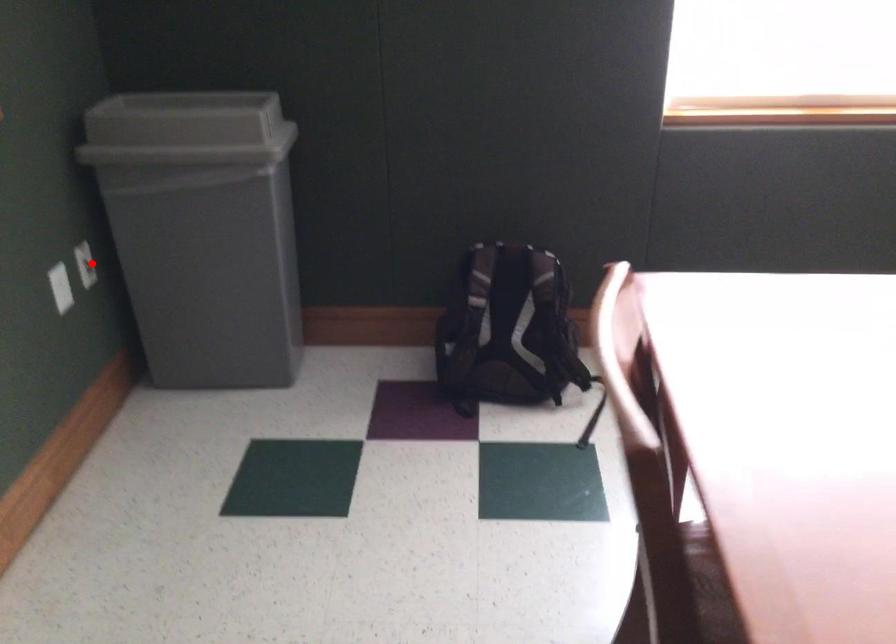
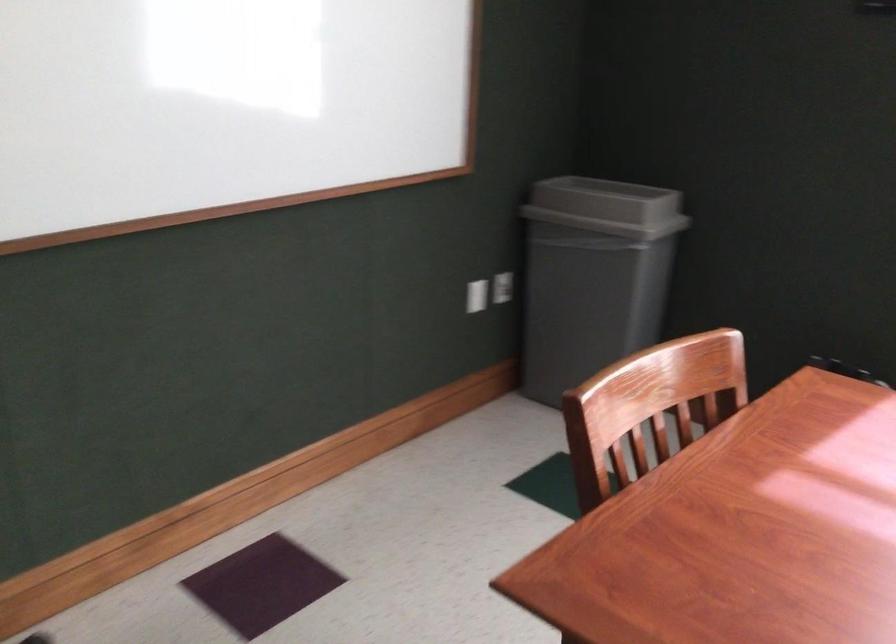
In the second image, find the point that corresponds to the highlighted location in the first image.

(503, 287)